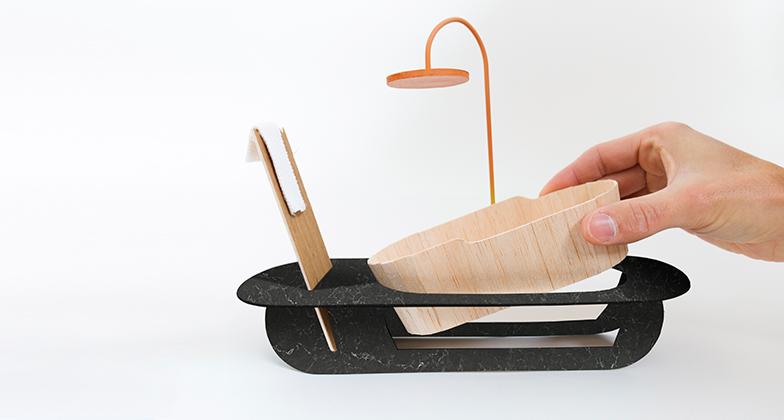
Image resolution: width=784 pixels, height=420 pixels. I want to click on shower head, so click(x=448, y=79).